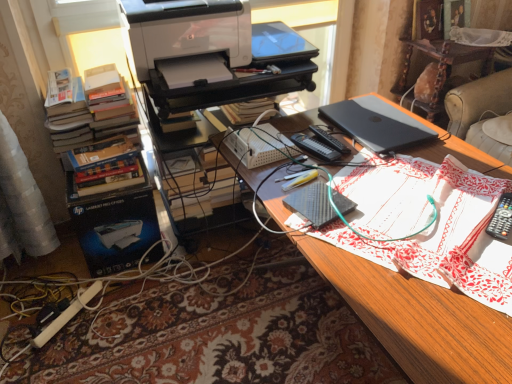
Locate an element on the screen. This screenshot has height=384, width=512. free area in between black plastic remote control at right and black textured notebook at center is located at coordinates (408, 216).